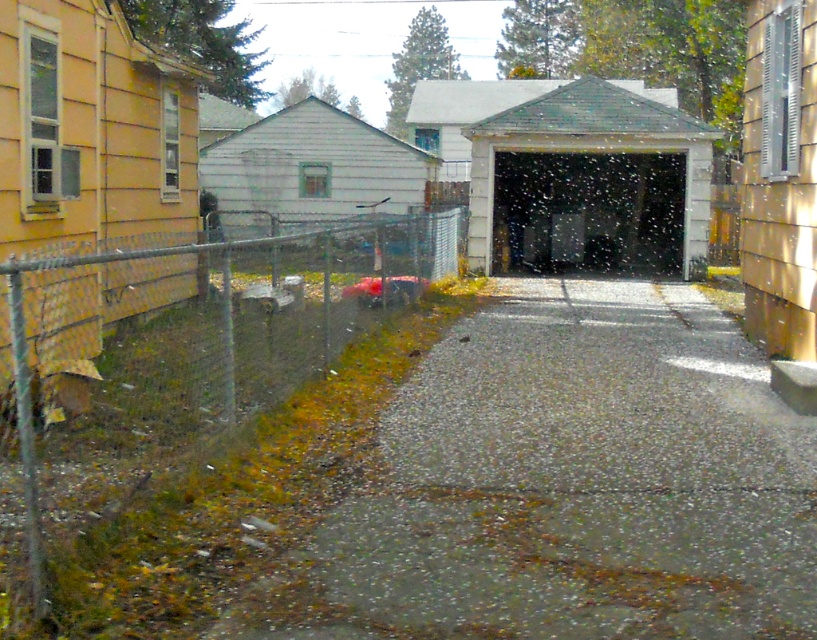
Question: Is gravelly asphalt driveway at center positioned at the back of metal chain-link fence at left?

Choices:
 (A) no
 (B) yes

Answer: (B)

Question: Can you confirm if gravelly asphalt driveway at center is wider than metal chain-link fence at left?

Choices:
 (A) yes
 (B) no

Answer: (B)

Question: Is gravelly asphalt driveway at center smaller than metal chain-link fence at left?

Choices:
 (A) yes
 (B) no

Answer: (A)

Question: Which object is farther from the camera taking this photo?

Choices:
 (A) metal chain-link fence at left
 (B) gravelly asphalt driveway at center

Answer: (B)